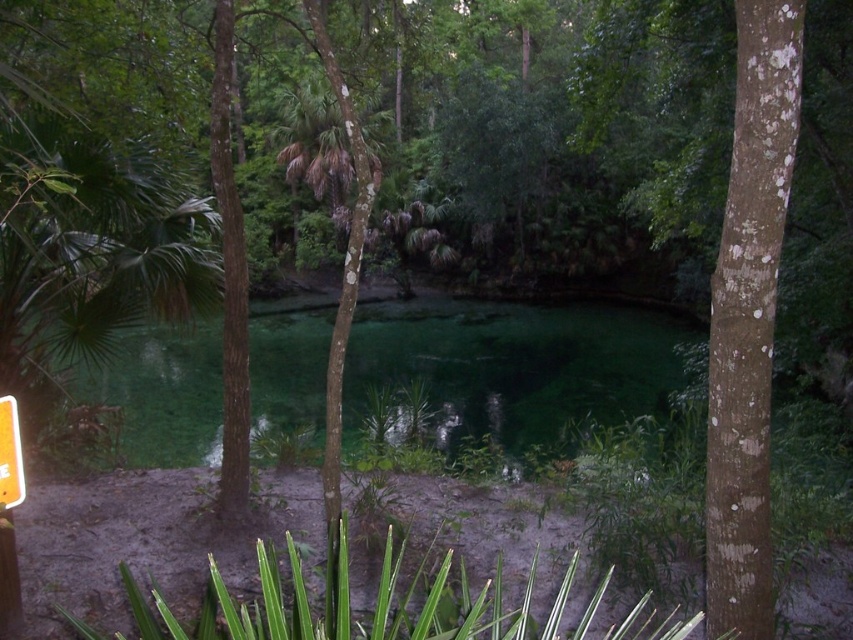
You are a hiker carrying a 20 meter long rope. You want to cross the distance between the green translucent water at center and the orange plastic sign at lower left. Can you safely use the rope to cross this distance?

The distance between the green translucent water at center and the orange plastic sign at lower left is 17.50 meters. Since the rope is 20 meters long, it is longer than the required distance, so you can safely use the rope to cross the distance between the green translucent water at center and the orange plastic sign at lower left.

You are a hiker who wants to place a small marker between the brown rough bark tree at right and the orange plastic sign at lower left. Based on their positions, which object should you place the marker closer to if you want it to be on the right side of both objects?

The marker should be placed closer to the brown rough bark tree at right because it is already positioned to the right of the orange plastic sign at lower left, so placing it near the tree would keep it on the right side of both objects.